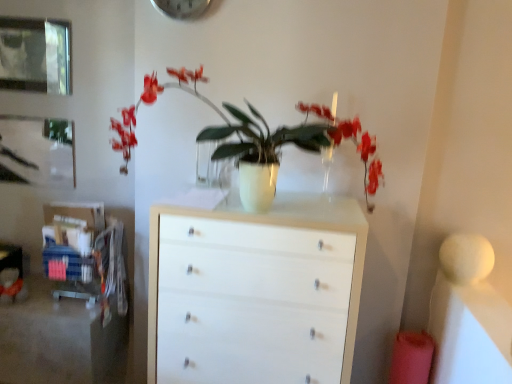
Question: Is white glossy chest of drawers at center positioned with its back to metallic glass picture frame at upper left, the first picture frame viewed from the front?

Choices:
 (A) no
 (B) yes

Answer: (A)

Question: Does white glossy chest of drawers at center have a greater height compared to metallic glass picture frame at upper left, the first picture frame in the top-to-bottom sequence?

Choices:
 (A) yes
 (B) no

Answer: (A)

Question: Is white glossy chest of drawers at center smaller than metallic glass picture frame at upper left, the 2th picture frame from the bottom?

Choices:
 (A) no
 (B) yes

Answer: (A)

Question: From a real-world perspective, is white glossy chest of drawers at center located higher than metallic glass picture frame at upper left, the first picture frame viewed from the front?

Choices:
 (A) yes
 (B) no

Answer: (B)

Question: Does white glossy chest of drawers at center have a lesser width compared to metallic glass picture frame at upper left, the first picture frame viewed from the front?

Choices:
 (A) no
 (B) yes

Answer: (A)

Question: In the image, is white glossy chest of drawers at center positioned in front of or behind metallic silver clock at upper center?

Choices:
 (A) front
 (B) behind

Answer: (A)

Question: From a real-world perspective, is white glossy chest of drawers at center positioned above or below metallic silver clock at upper center?

Choices:
 (A) below
 (B) above

Answer: (A)

Question: Considering the positions of white glossy chest of drawers at center and metallic silver clock at upper center in the image, is white glossy chest of drawers at center wider or thinner than metallic silver clock at upper center?

Choices:
 (A) wide
 (B) thin

Answer: (A)

Question: Is white glossy chest of drawers at center inside or outside of metallic silver clock at upper center?

Choices:
 (A) outside
 (B) inside

Answer: (A)

Question: From the image's perspective, is brushed metal picture frame at upper left, which is the 2th picture frame from front to back, positioned above or below white glossy vase at center?

Choices:
 (A) below
 (B) above

Answer: (B)

Question: Choose the correct answer: Is brushed metal picture frame at upper left, which ranks as the first picture frame in back-to-front order, inside white glossy vase at center or outside it?

Choices:
 (A) outside
 (B) inside

Answer: (A)

Question: From a real-world perspective, is brushed metal picture frame at upper left, which is the 2th picture frame from front to back, positioned above or below white glossy vase at center?

Choices:
 (A) below
 (B) above

Answer: (A)

Question: Is brushed metal picture frame at upper left, which ranks as the first picture frame in back-to-front order, to the left or to the right of white glossy vase at center in the image?

Choices:
 (A) right
 (B) left

Answer: (B)

Question: Considering the positions of metallic silver clock at upper center and white glossy chest of drawers at center in the image, is metallic silver clock at upper center wider or thinner than white glossy chest of drawers at center?

Choices:
 (A) wide
 (B) thin

Answer: (B)

Question: From the image's perspective, is metallic silver clock at upper center above or below white glossy chest of drawers at center?

Choices:
 (A) below
 (B) above

Answer: (B)